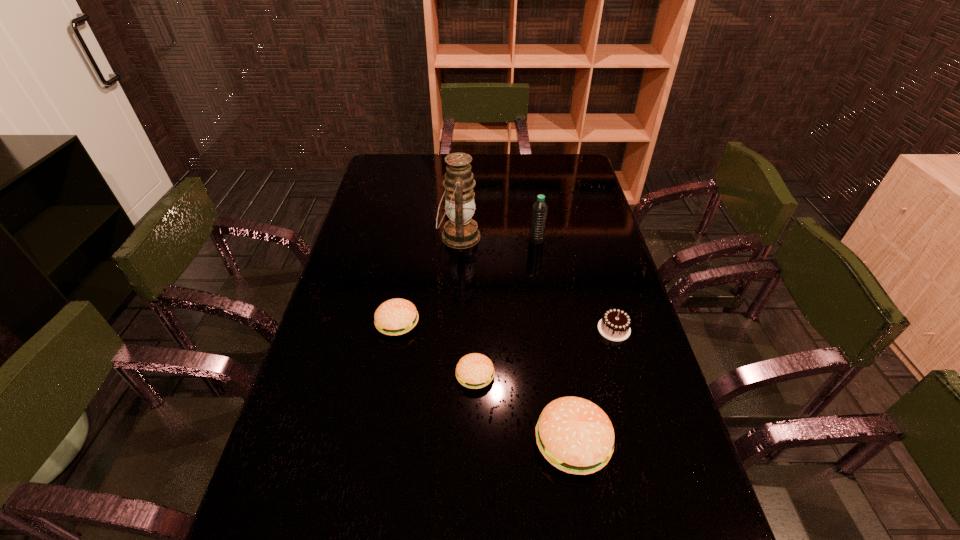
Where is `vacant point located between the chocolate cake and the leftmost object`? The image size is (960, 540). vacant point located between the chocolate cake and the leftmost object is located at coordinates (506, 326).

Locate an element on the screen. The image size is (960, 540). vacant area that lies between the lantern and the leftmost patty is located at coordinates (428, 280).

Identify the location of free point between the second nearest patty and the farthest patty. 437,349.

The height and width of the screenshot is (540, 960). I want to click on the closest object relative to the chocolate cake, so click(576, 436).

Point out which object is positioned as the nearest to the second patty from right to left. Please provide its 2D coordinates. Your answer should be formatted as a tuple, i.e. [(x, y)], where the tuple contains the x and y coordinates of a point satisfying the conditions above.

[(576, 436)]

Identify which patty is the third closest to the chocolate cake. Please provide its 2D coordinates. Your answer should be formatted as a tuple, i.e. [(x, y)], where the tuple contains the x and y coordinates of a point satisfying the conditions above.

[(397, 316)]

Locate an element on the screen. patty that stands as the second closest to the lantern is located at coordinates (475, 370).

Identify the location of vacant area in the image that satisfies the following two spatial constraints: 1. on the front side of the second patty from left to right; 2. on the left side of the lantern. (451, 375).

Image resolution: width=960 pixels, height=540 pixels. Find the location of `vacant space that satisfies the following two spatial constraints: 1. on the back side of the fifth shortest object; 2. on the left side of the farthest patty`. vacant space that satisfies the following two spatial constraints: 1. on the back side of the fifth shortest object; 2. on the left side of the farthest patty is located at coordinates (413, 241).

This screenshot has height=540, width=960. What are the coordinates of `free space that satisfies the following two spatial constraints: 1. on the back side of the second nearest object; 2. on the right side of the fifth shortest object` in the screenshot? It's located at (476, 241).